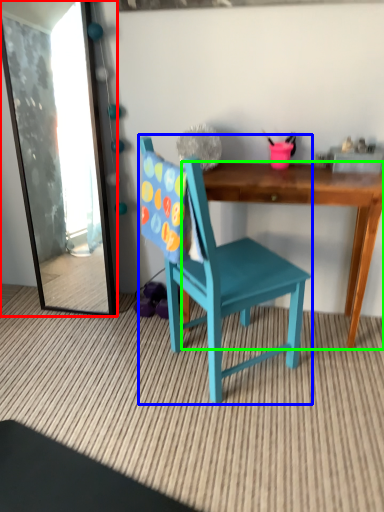
Question: Based on their relative distances, which object is nearer to mirror (highlighted by a red box)? Choose from chair (highlighted by a blue box) and desk (highlighted by a green box).

Choices:
 (A) chair
 (B) desk

Answer: (A)